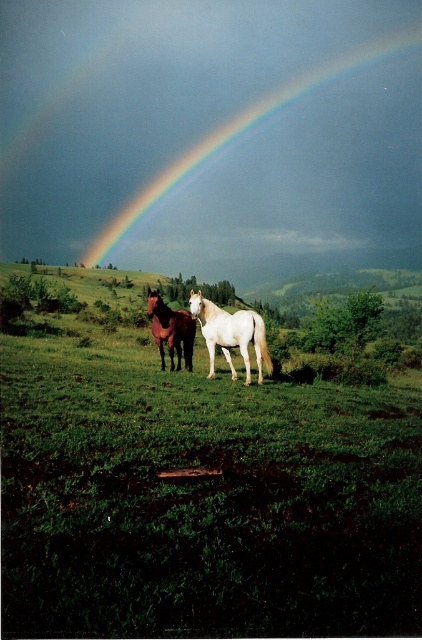
You are a farmer trying to determine which horse to lead to the barn first. Based on their sizes, which horse would require more space in the barn? Please refer to the white glossy horse at center and the brown glossy horse at center in the image.

The brown glossy horse at center is larger in size compared to the white glossy horse at center, so it would require more space in the barn.

In the scene shown: You are a photographer trying to capture both the white glossy horse at center and the brown glossy horse at center in a single frame. Based on their sizes, which horse would appear smaller in the photo?

The white glossy horse at center would appear smaller in the photo because it has a lesser width compared to the brown glossy horse at center.